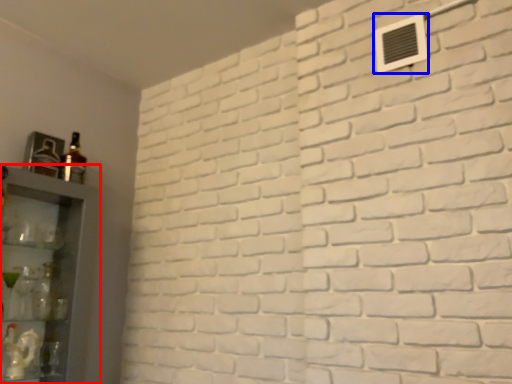
Question: Which of the following is the farthest to the observer, shelf (highlighted by a red box) or air conditioning (highlighted by a blue box)?

Choices:
 (A) shelf
 (B) air conditioning

Answer: (B)